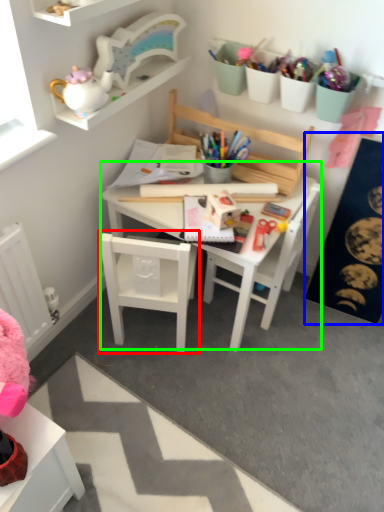
Question: Considering the real-world distances, which object is closest to chair (highlighted by a red box)? bulletin board (highlighted by a blue box) or table (highlighted by a green box).

Choices:
 (A) bulletin board
 (B) table

Answer: (B)